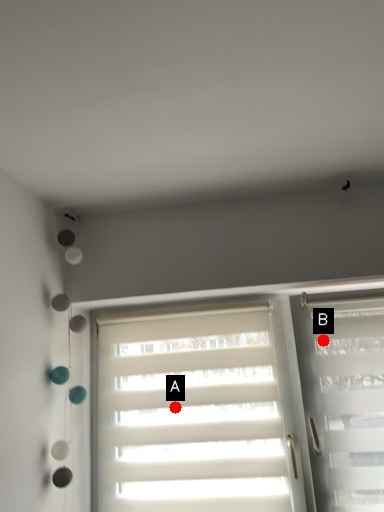
Question: Two points are circled on the image, labeled by A and B beside each circle. Which point appears closest to the camera in this image?

Choices:
 (A) A is closer
 (B) B is closer

Answer: (B)